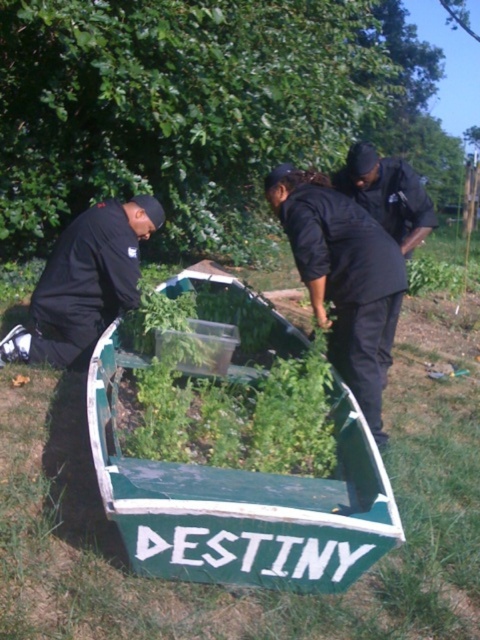
You are standing at the origin point in the scene. There are two points marked in the image. The first point is at coordinates point (141, 518) and the second point is at coordinates point (375, 188). Which point is closer to you?

Point (141, 518) is in front of point (375, 188), so it is closer to you.

You are a security guard on patrol and see the black matte jacket at left and the black matte uniform at upper right. Which one is nearer to you?

The black matte jacket at left is closer to the viewer than the black matte uniform at upper right.

You are a park ranger who just arrived at the scene. You see the green painted wood boat at center and the black matte uniform at upper right. Which object is positioned more to the left side of the image?

The green painted wood boat at center is positioned more to the left side of the image than the black matte uniform at upper right.